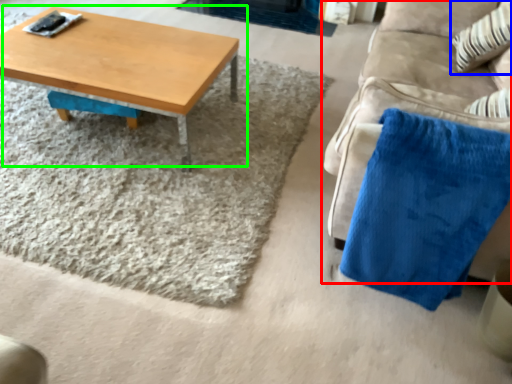
Question: Which object is positioned closest to studio couch (highlighted by a red box)? Select from throw pillow (highlighted by a blue box) and coffee table (highlighted by a green box).

Choices:
 (A) throw pillow
 (B) coffee table

Answer: (A)